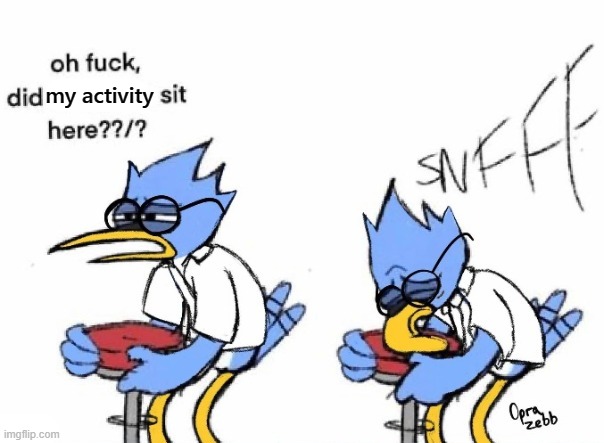
I want to click on stool cushion, so click(x=121, y=336).